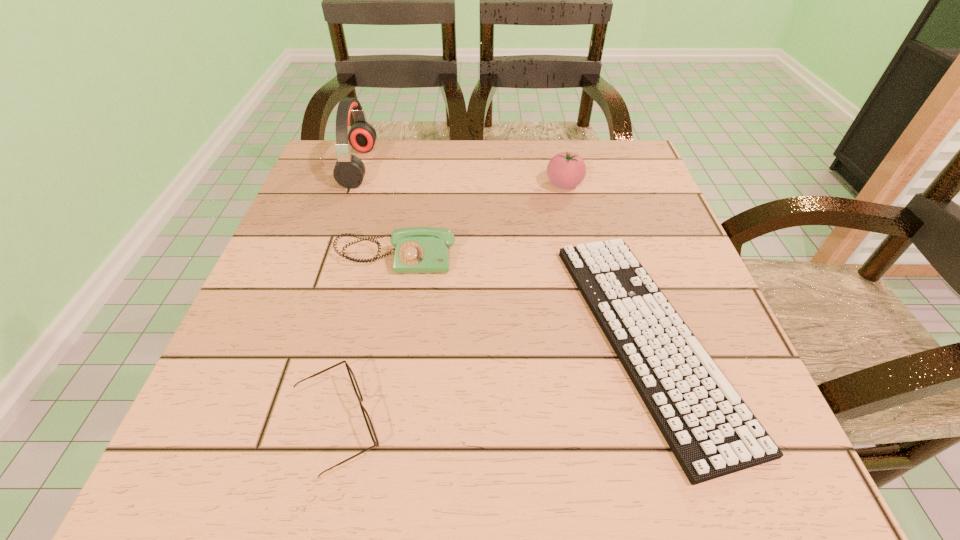
The height and width of the screenshot is (540, 960). I want to click on free location that satisfies the following two spatial constraints: 1. on the dial of the third shortest object; 2. on the right side of the shortest object, so click(380, 337).

Locate an element on the screen. This screenshot has width=960, height=540. free location that satisfies the following two spatial constraints: 1. on the front side of the fourth shortest object; 2. on the right side of the shortest object is located at coordinates (600, 337).

Locate an element on the screen. The height and width of the screenshot is (540, 960). vacant space that satisfies the following two spatial constraints: 1. on the dial of the shortest object; 2. on the left side of the third tallest object is located at coordinates (380, 337).

Where is `free space that satisfies the following two spatial constraints: 1. on the dial of the shortest object; 2. on the left side of the third tallest object`? Image resolution: width=960 pixels, height=540 pixels. free space that satisfies the following two spatial constraints: 1. on the dial of the shortest object; 2. on the left side of the third tallest object is located at coordinates (380, 337).

Where is `vacant area that satisfies the following two spatial constraints: 1. on the dial of the telephone; 2. on the right side of the shortest object`? This screenshot has height=540, width=960. vacant area that satisfies the following two spatial constraints: 1. on the dial of the telephone; 2. on the right side of the shortest object is located at coordinates pos(380,337).

The height and width of the screenshot is (540, 960). Find the location of `free spot that satisfies the following two spatial constraints: 1. on the ear cups of the tallest object; 2. on the back side of the fourth shortest object`. free spot that satisfies the following two spatial constraints: 1. on the ear cups of the tallest object; 2. on the back side of the fourth shortest object is located at coordinates (353, 184).

Where is `vacant point that satisfies the following two spatial constraints: 1. on the front side of the shortest object; 2. with the lenses facing outward on the spectacles`? This screenshot has height=540, width=960. vacant point that satisfies the following two spatial constraints: 1. on the front side of the shortest object; 2. with the lenses facing outward on the spectacles is located at coordinates (x=678, y=425).

Image resolution: width=960 pixels, height=540 pixels. I want to click on free space that satisfies the following two spatial constraints: 1. on the ear cups of the tallest object; 2. on the back side of the computer keyboard, so 300,337.

You are a GUI agent. You are given a task and a screenshot of the screen. Output one action in this format:
    pyautogui.click(x=<x>, y=<y>)
    Task: Click on the free spot that satisfies the following two spatial constraints: 1. on the front side of the computer keyboard; 2. on the right side of the tomato
    
    Given the screenshot: What is the action you would take?
    pyautogui.click(x=600, y=337)

This screenshot has width=960, height=540. I want to click on vacant area in the image that satisfies the following two spatial constraints: 1. on the ear cups of the shortest object; 2. on the left side of the tallest object, so click(x=300, y=337).